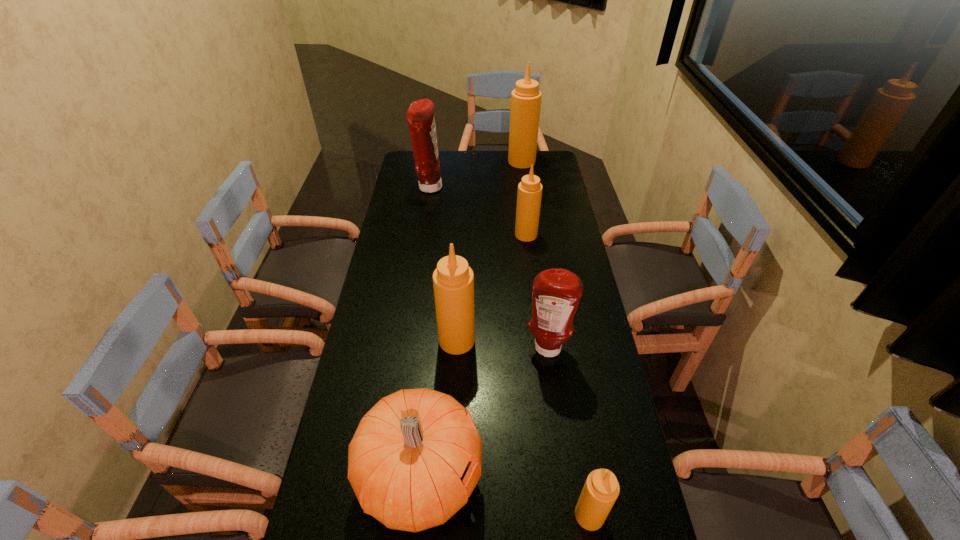
Choose which object is the fifth nearest neighbor to the tallest object. Please provide its 2D coordinates. Your answer should be formatted as a tuple, i.e. [(x, y)], where the tuple contains the x and y coordinates of a point satisfying the conditions above.

[(415, 458)]

Locate an element on the screen. condiment identified as the sixth closest to the pumpkin is located at coordinates coord(526,97).

Identify which condiment is the fourth closest to the shortest object. Please provide its 2D coordinates. Your answer should be formatted as a tuple, i.e. [(x, y)], where the tuple contains the x and y coordinates of a point satisfying the conditions above.

[(420, 117)]

I want to click on tan condiment object that ranks as the second closest to the second farthest condiment, so click(x=529, y=195).

Locate which tan condiment ranks in proximity to the third biggest tan condiment. Please provide its 2D coordinates. Your answer should be formatted as a tuple, i.e. [(x, y)], where the tuple contains the x and y coordinates of a point satisfying the conditions above.

[(453, 280)]

In order to click on red condiment that is the nearest to the pumpkin in this screenshot , I will do `click(556, 293)`.

Where is `red condiment that is the nearest to the biggest tan condiment`? This screenshot has height=540, width=960. red condiment that is the nearest to the biggest tan condiment is located at coordinates (420, 117).

At what (x,y) coordinates should I click in order to perform the action: click on vacant area that satisfies the following two spatial constraints: 1. on the front side of the shortest object; 2. on the right side of the leftmost condiment. Please return your answer as a coordinate pair (x, y). The width and height of the screenshot is (960, 540). Looking at the image, I should click on (380, 515).

The width and height of the screenshot is (960, 540). I want to click on vacant space that satisfies the following two spatial constraints: 1. on the back side of the fourth nearest condiment; 2. on the left side of the leftmost tan condiment, so click(462, 235).

Where is `vacant area in the image that satisfies the following two spatial constraints: 1. on the front side of the leftmost tan condiment; 2. on the left side of the nearer red condiment`? The image size is (960, 540). vacant area in the image that satisfies the following two spatial constraints: 1. on the front side of the leftmost tan condiment; 2. on the left side of the nearer red condiment is located at coordinates (456, 349).